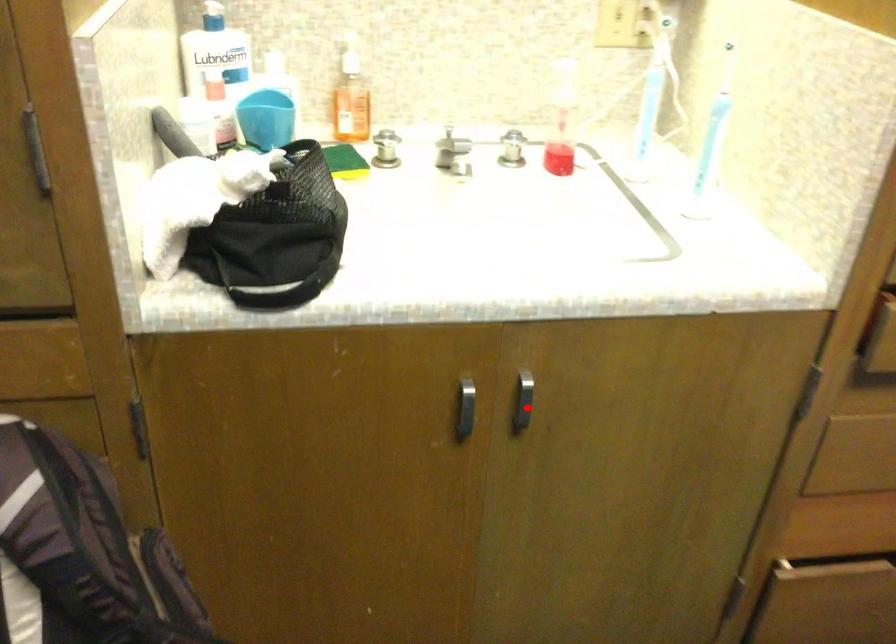
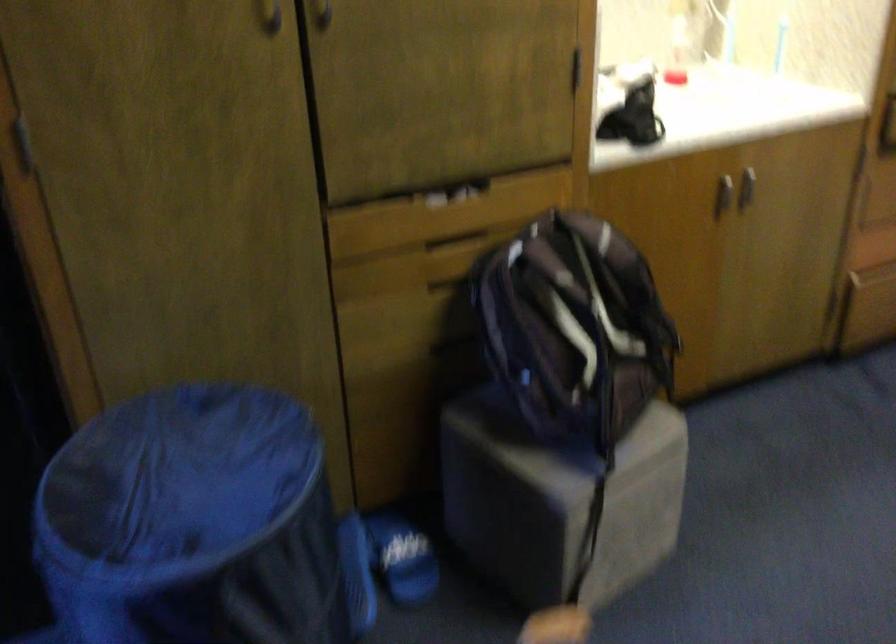
Find the pixel in the second image that matches the highlighted location in the first image.

(746, 187)